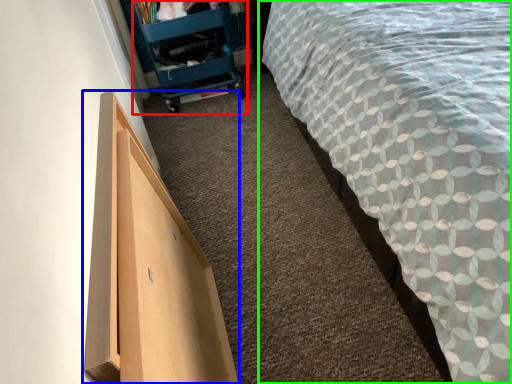
Question: Estimate the real-world distances between objects in this image. Which object is closer to trolley (highlighted by a red box), furniture (highlighted by a blue box) or bed (highlighted by a green box)?

Choices:
 (A) furniture
 (B) bed

Answer: (B)